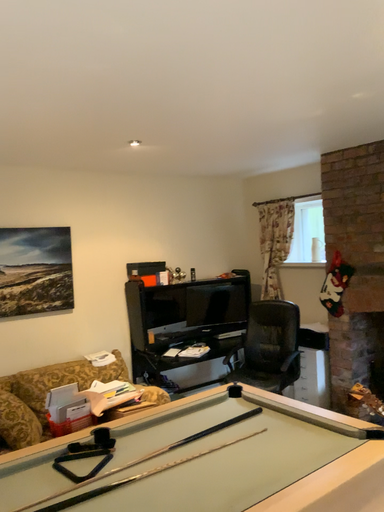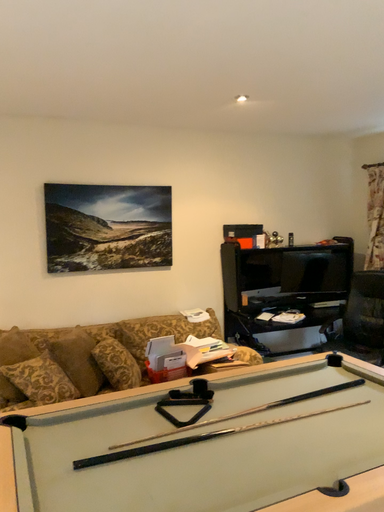
Question: Which way did the camera rotate in the video?

Choices:
 (A) rotated right
 (B) rotated left

Answer: (B)